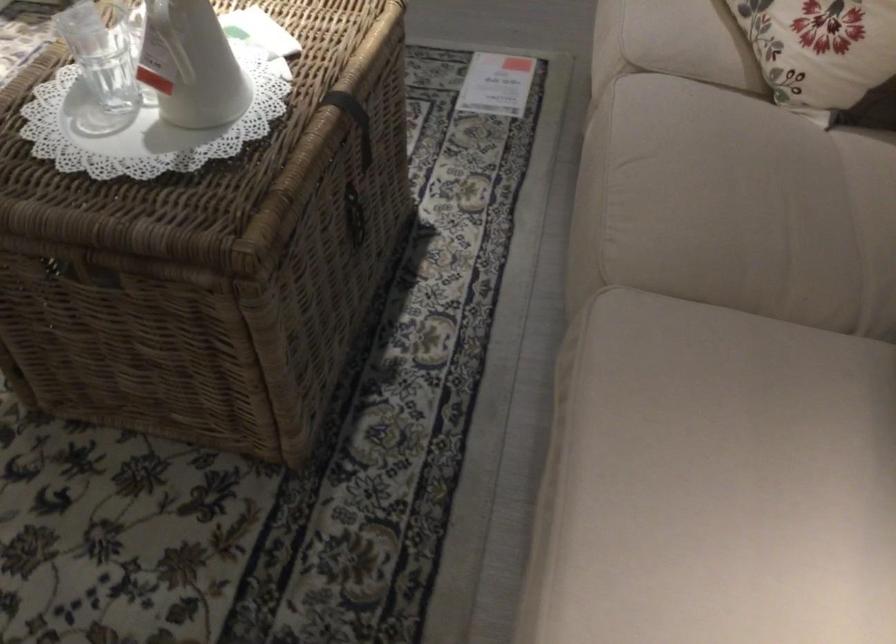
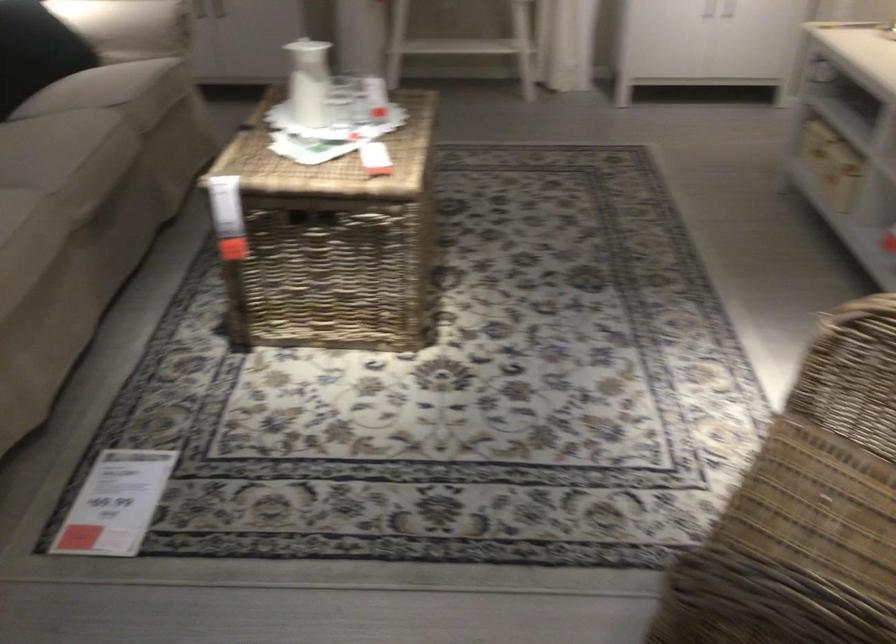
Find the pixel in the second image that matches (606,200) in the first image.

(109, 140)